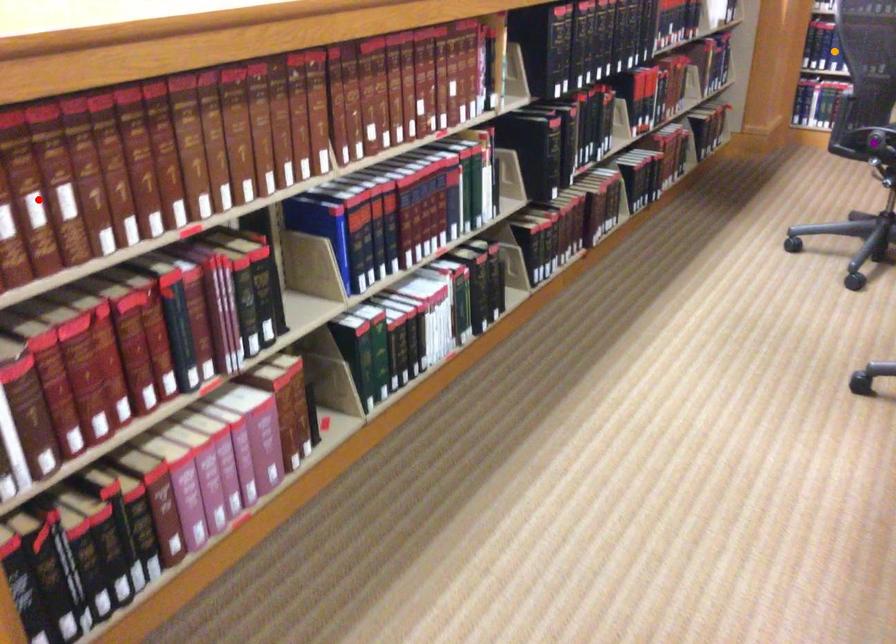
Order these from farthest to nearest:
red point, orange point, purple point

orange point, purple point, red point